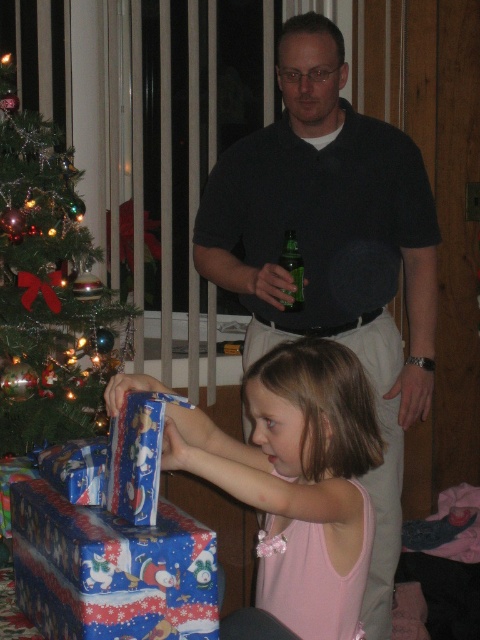
Does dark gray shirt at center appear over shiny green tree at left?

No, dark gray shirt at center is not above shiny green tree at left.

Find the location of a particular element. The width and height of the screenshot is (480, 640). dark gray shirt at center is located at coordinates (333, 253).

What are the coordinates of `dark gray shirt at center` in the screenshot? It's located at (333, 253).

In the scene shown: Is dark gray shirt at center further to camera compared to matte blue wrapping paper at lower center?

That is True.

Can you confirm if dark gray shirt at center is positioned to the right of matte blue wrapping paper at lower center?

Indeed, dark gray shirt at center is positioned on the right side of matte blue wrapping paper at lower center.

This screenshot has width=480, height=640. What are the coordinates of `dark gray shirt at center` in the screenshot? It's located at (333, 253).

Which is in front, point (54, 470) or point (302, 304)?

Point (54, 470)

Between blue shiny wrapping paper at lower left and green glass bottle at center, which one is positioned lower?

Positioned lower is blue shiny wrapping paper at lower left.

Is point (67, 483) more distant than point (292, 276)?

That is False.

Where is `blue shiny wrapping paper at lower left`? The width and height of the screenshot is (480, 640). blue shiny wrapping paper at lower left is located at coordinates (76, 468).